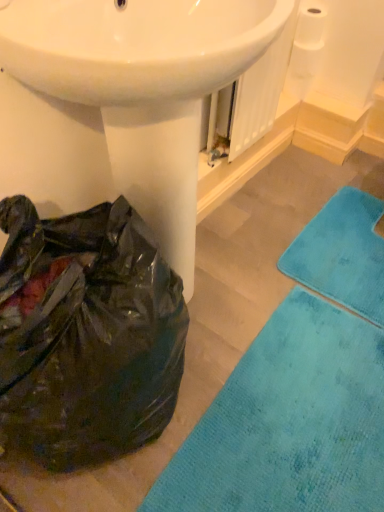
Identify the location of empty space that is in between white glossy sink at center and black plastic bag at lower left. This screenshot has width=384, height=512. (230, 318).